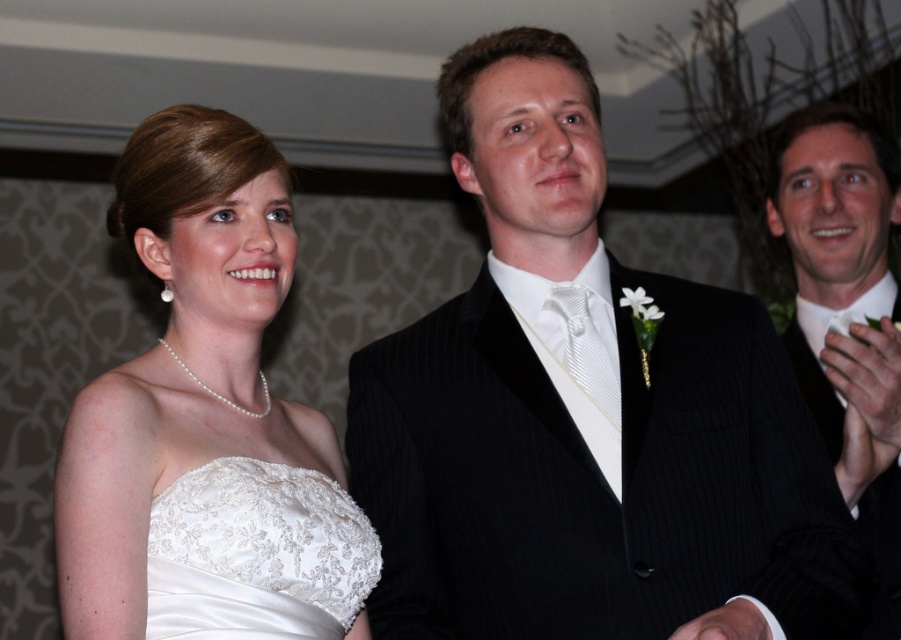
Question: Which point is closer to the camera?

Choices:
 (A) (881, 632)
 (B) (217, 556)

Answer: (B)

Question: Which object is the farthest from the black pinstripe suit at right?

Choices:
 (A) white satin dress at left
 (B) white lace dress at center

Answer: (B)

Question: Which object is positioned farthest from the black pinstripe suit at right?

Choices:
 (A) white lace dress at center
 (B) white satin dress at left

Answer: (A)

Question: Considering the relative positions of white satin dress at left and white lace dress at center in the image provided, where is white satin dress at left located with respect to white lace dress at center?

Choices:
 (A) right
 (B) left

Answer: (B)

Question: Considering the relative positions of black pinstripe suit at right and white lace dress at center in the image provided, where is black pinstripe suit at right located with respect to white lace dress at center?

Choices:
 (A) above
 (B) below

Answer: (A)

Question: Where is black pinstripe suit at right located in relation to white lace dress at center in the image?

Choices:
 (A) below
 (B) above

Answer: (B)